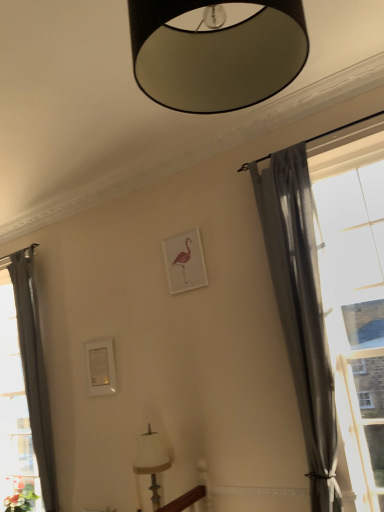
Question: Considering the relative positions of white fabric lampshade at lower center, which appears as the second lamp when viewed from the top, and gray sheer curtain at right, the first curtain when ordered from right to left, in the image provided, is white fabric lampshade at lower center, which appears as the second lamp when viewed from the top, to the right of gray sheer curtain at right, the first curtain when ordered from right to left, from the viewer's perspective?

Choices:
 (A) no
 (B) yes

Answer: (A)

Question: Is white fabric lampshade at lower center, the 1th lamp when ordered from back to front, looking in the opposite direction of gray sheer curtain at right, which is the 2th curtain from back to front?

Choices:
 (A) no
 (B) yes

Answer: (A)

Question: Is white fabric lampshade at lower center, the first lamp when ordered from bottom to top, in front of gray sheer curtain at right, which is the 2th curtain from back to front?

Choices:
 (A) no
 (B) yes

Answer: (A)

Question: Is white fabric lampshade at lower center, the 1th lamp when ordered from back to front, behind gray sheer curtain at right, the second curtain from the left?

Choices:
 (A) no
 (B) yes

Answer: (B)

Question: From a real-world perspective, is white fabric lampshade at lower center, the 1th lamp when ordered from back to front, under gray sheer curtain at right, marked as the 1th curtain in a front-to-back arrangement?

Choices:
 (A) no
 (B) yes

Answer: (B)

Question: From their relative heights in the image, would you say white matte picture frame at center is taller or shorter than white fabric lampshade at lower center, the first lamp when ordered from bottom to top?

Choices:
 (A) short
 (B) tall

Answer: (A)

Question: Is point (201, 283) closer or farther from the camera than point (132, 465)?

Choices:
 (A) closer
 (B) farther

Answer: (B)

Question: Considering the positions of white matte picture frame at center and white fabric lampshade at lower center, the first lamp when ordered from bottom to top, in the image, is white matte picture frame at center wider or thinner than white fabric lampshade at lower center, the first lamp when ordered from bottom to top,?

Choices:
 (A) wide
 (B) thin

Answer: (B)

Question: From the image's perspective, is white matte picture frame at center positioned above or below white fabric lampshade at lower center, the first lamp when ordered from bottom to top?

Choices:
 (A) below
 (B) above

Answer: (B)

Question: Considering the positions of point (276, 225) and point (372, 508), is point (276, 225) closer or farther from the camera than point (372, 508)?

Choices:
 (A) farther
 (B) closer

Answer: (A)

Question: From a real-world perspective, relative to transparent glass window at right, is gray sheer curtain at right, the first curtain when ordered from right to left, vertically above or below?

Choices:
 (A) above
 (B) below

Answer: (A)

Question: Is gray sheer curtain at right, the second curtain from the left, spatially inside transparent glass window at right, or outside of it?

Choices:
 (A) inside
 (B) outside

Answer: (B)

Question: Is gray sheer curtain at right, the first curtain when ordered from right to left, taller or shorter than transparent glass window at right?

Choices:
 (A) short
 (B) tall

Answer: (A)

Question: Is gray sheer curtain at right, the second curtain from the left, inside or outside of white matte picture frame at center?

Choices:
 (A) outside
 (B) inside

Answer: (A)

Question: Does point (307, 218) appear closer or farther from the camera than point (192, 285)?

Choices:
 (A) farther
 (B) closer

Answer: (B)